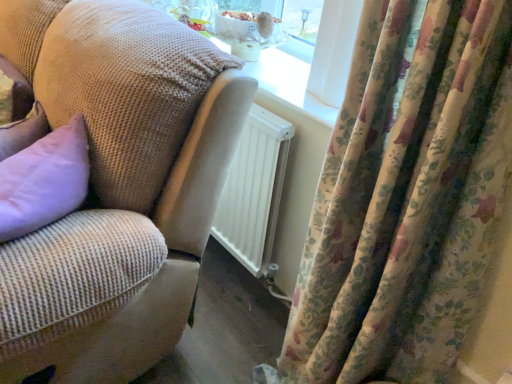
Question: Should I look upward or downward to see floral velvet curtains at right?

Choices:
 (A) up
 (B) down

Answer: (B)

Question: From a real-world perspective, is floral velvet curtains at right on woven fabric couch at center?

Choices:
 (A) yes
 (B) no

Answer: (A)

Question: From a real-world perspective, is floral velvet curtains at right physically below woven fabric couch at center?

Choices:
 (A) yes
 (B) no

Answer: (B)

Question: Considering the relative sizes of floral velvet curtains at right and woven fabric couch at center in the image provided, is floral velvet curtains at right smaller than woven fabric couch at center?

Choices:
 (A) yes
 (B) no

Answer: (A)

Question: Is floral velvet curtains at right directly adjacent to woven fabric couch at center?

Choices:
 (A) yes
 (B) no

Answer: (B)

Question: Considering the relative sizes of floral velvet curtains at right and woven fabric couch at center in the image provided, is floral velvet curtains at right wider than woven fabric couch at center?

Choices:
 (A) no
 (B) yes

Answer: (A)

Question: Can you confirm if floral velvet curtains at right is positioned to the right of woven fabric couch at center?

Choices:
 (A) yes
 (B) no

Answer: (A)

Question: From a real-world perspective, is woven fabric couch at center on top of floral velvet curtains at right?

Choices:
 (A) no
 (B) yes

Answer: (A)

Question: Could floral velvet curtains at right be considered to be inside woven fabric couch at center?

Choices:
 (A) yes
 (B) no

Answer: (B)

Question: Does woven fabric couch at center have a lesser height compared to floral velvet curtains at right?

Choices:
 (A) no
 (B) yes

Answer: (B)

Question: Can you confirm if woven fabric couch at center is taller than floral velvet curtains at right?

Choices:
 (A) no
 (B) yes

Answer: (A)

Question: Considering the relative sizes of woven fabric couch at center and floral velvet curtains at right in the image provided, is woven fabric couch at center bigger than floral velvet curtains at right?

Choices:
 (A) yes
 (B) no

Answer: (A)

Question: Considering the relative positions of woven fabric couch at center and floral velvet curtains at right in the image provided, is woven fabric couch at center to the left of floral velvet curtains at right from the viewer's perspective?

Choices:
 (A) yes
 (B) no

Answer: (A)

Question: In terms of height, does floral velvet curtains at right look taller or shorter compared to woven fabric couch at center?

Choices:
 (A) tall
 (B) short

Answer: (A)